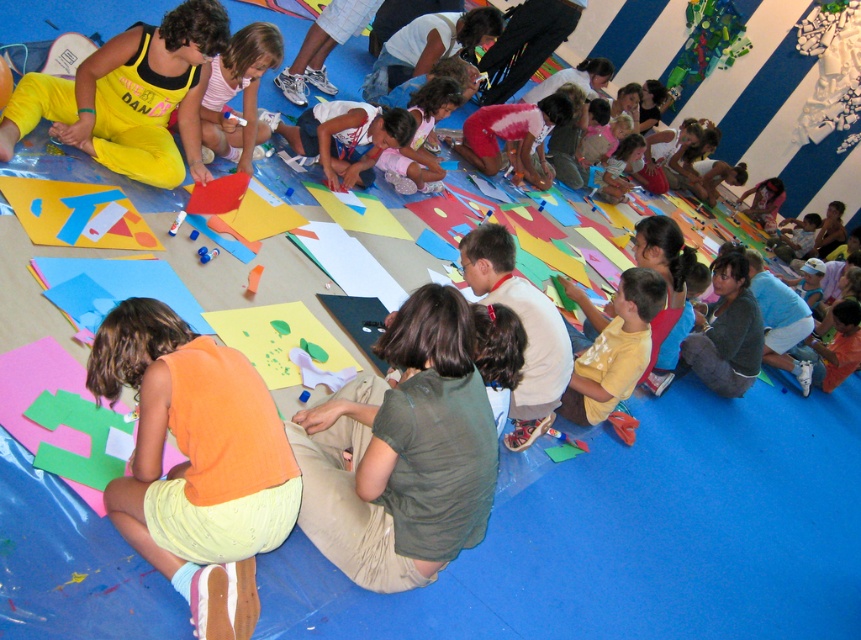
Between point (386, 536) and point (490, 257), which one is positioned in front?

Point (386, 536) is more forward.

Can you confirm if dark green shirt at center is taller than matte khaki pants at center?

Incorrect, dark green shirt at center's height is not larger of matte khaki pants at center's.

Identify the location of dark green shirt at center. The width and height of the screenshot is (861, 640). (401, 452).

Can you confirm if matte white shirt at center is wider than fluffy pink sweater at center?

Correct, the width of matte white shirt at center exceeds that of fluffy pink sweater at center.

Does matte white shirt at center come behind fluffy pink sweater at center?

No, matte white shirt at center is closer to the viewer.

At what (x,y) coordinates should I click in order to perform the action: click on matte white shirt at center. Please return your answer as a coordinate pair (x, y). This screenshot has height=640, width=861. Looking at the image, I should click on (426, 49).

I want to click on matte white shirt at center, so click(426, 49).

In the scene shown: Is orange cotton shirt at lower left below pink fabric shirt at center?

Yes.

The height and width of the screenshot is (640, 861). In order to click on orange cotton shirt at lower left in this screenshot , I will do [x=196, y=460].